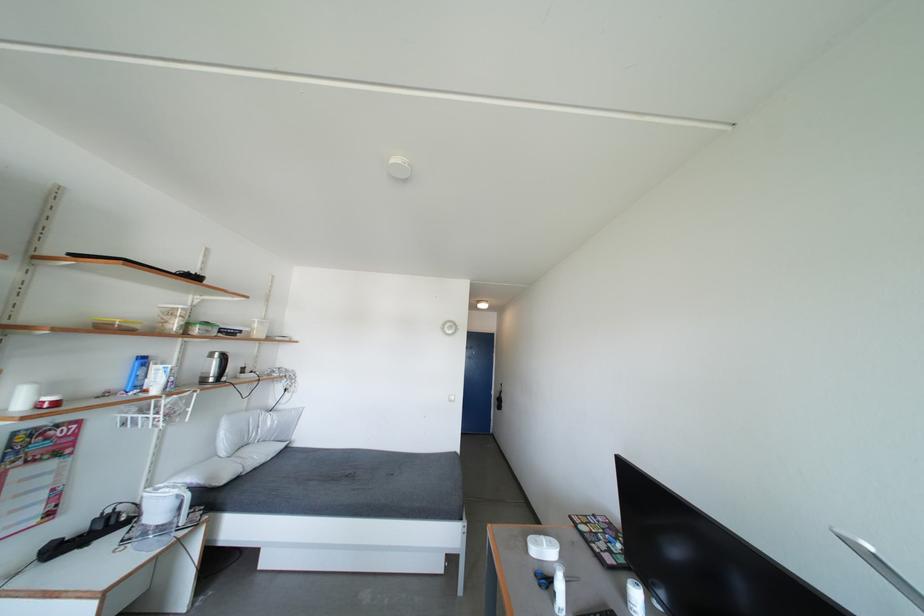
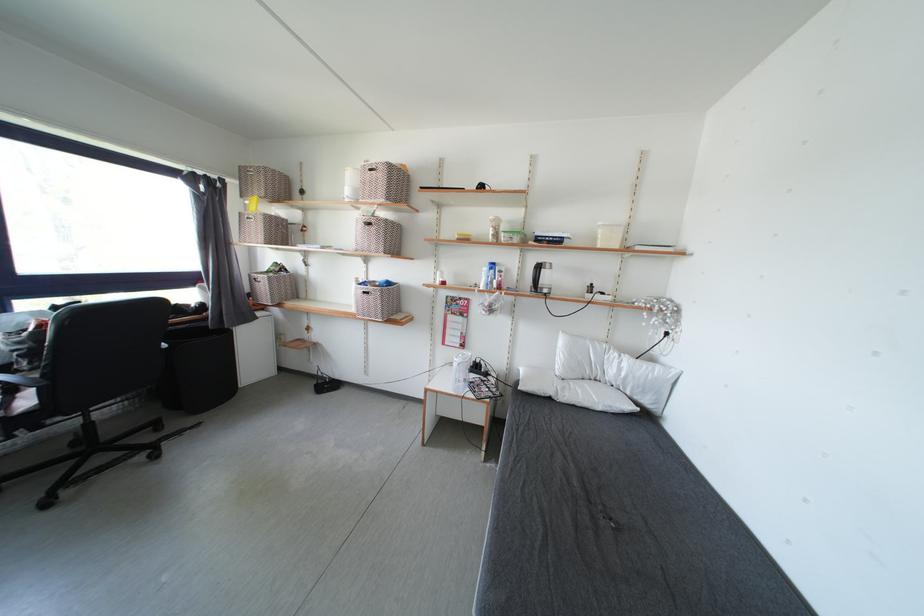
Find the pixel in the second image that matches point 43,525 in the first image.

(465, 351)